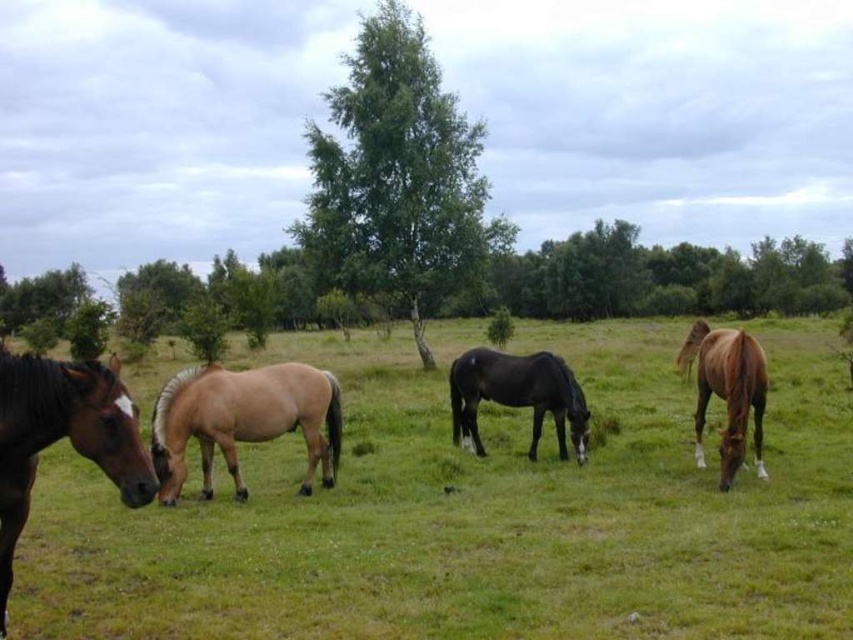
Is brown glossy horse at left taller than shiny black horse at center?

Correct, brown glossy horse at left is much taller as shiny black horse at center.

How far apart are brown glossy horse at left and shiny black horse at center?

brown glossy horse at left and shiny black horse at center are 6.52 meters apart.

What do you see at coordinates (62, 436) in the screenshot? The image size is (853, 640). I see `brown glossy horse at left` at bounding box center [62, 436].

This screenshot has width=853, height=640. What are the coordinates of `brown glossy horse at left` in the screenshot? It's located at (62, 436).

Between green grass pasture at lower left and shiny black horse at center, which one appears on the left side from the viewer's perspective?

shiny black horse at center

Can you confirm if green grass pasture at lower left is bigger than shiny black horse at center?

Yes, green grass pasture at lower left is bigger than shiny black horse at center.

Which is behind, point (810, 356) or point (453, 388)?

The point (810, 356) is more distant.

At what (x,y) coordinates should I click in order to perform the action: click on green grass pasture at lower left. Please return your answer as a coordinate pair (x, y). This screenshot has width=853, height=640. Looking at the image, I should click on (476, 515).

From the picture: Does light brown glossy horse at center have a lesser width compared to brown glossy horse at right?

Correct, light brown glossy horse at center's width is less than brown glossy horse at right's.

Is light brown glossy horse at center wider than brown glossy horse at right?

No.

You are a GUI agent. You are given a task and a screenshot of the screen. Output one action in this format:
    pyautogui.click(x=<x>, y=<y>)
    Task: Click on the light brown glossy horse at center
    This screenshot has height=640, width=853.
    Given the screenshot: What is the action you would take?
    pyautogui.click(x=244, y=420)